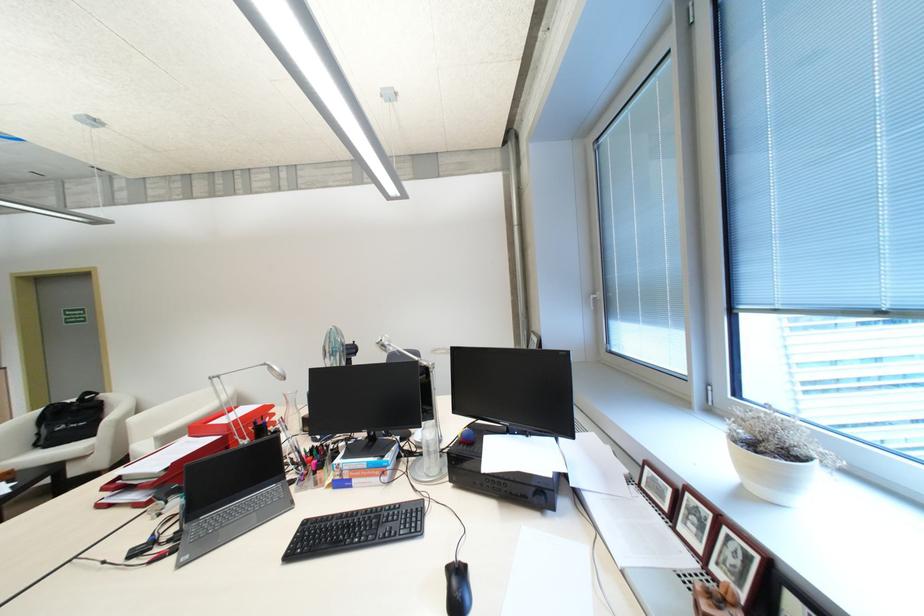
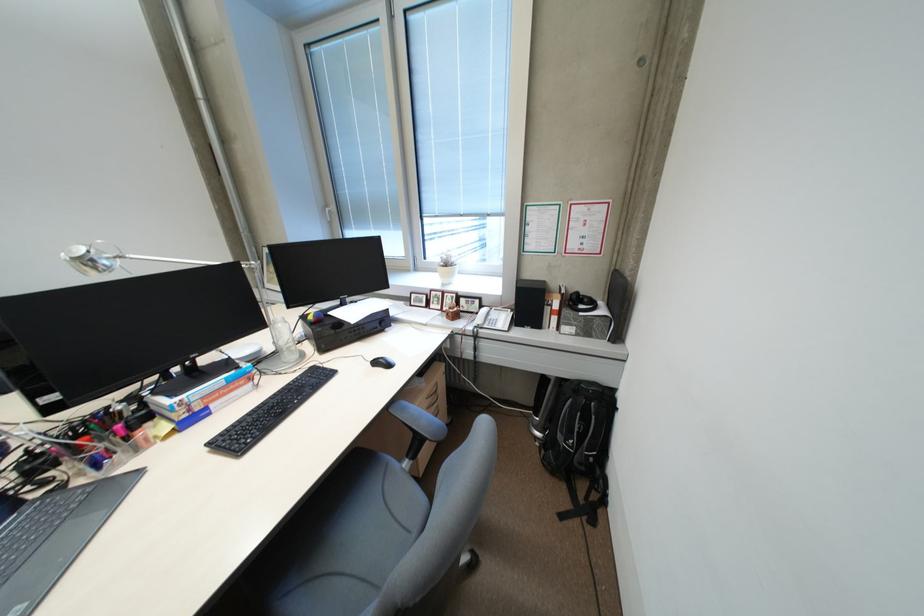
The images are taken continuously from a first-person perspective. In which direction is your viewpoint rotating?

The rotation direction of the camera is right-down.